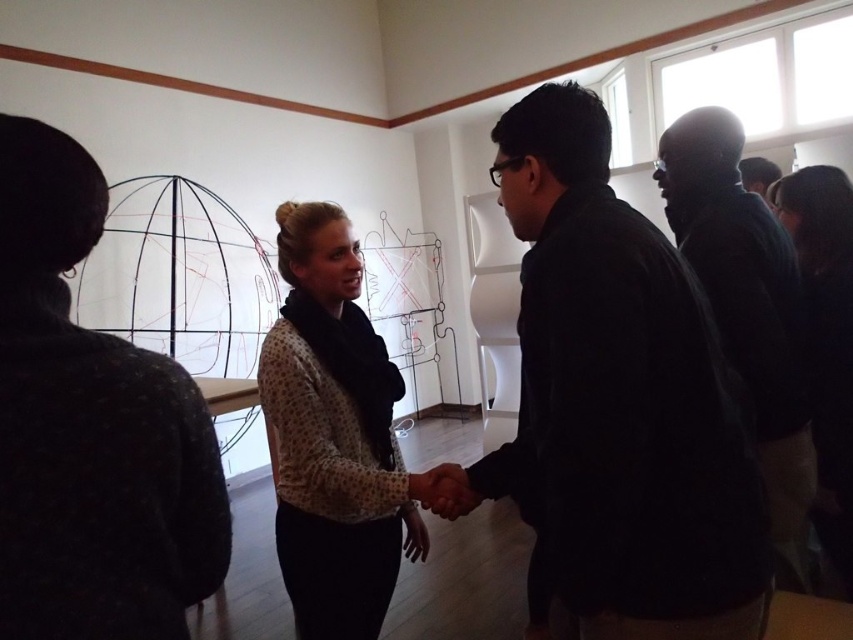
Question: Estimate the real-world distances between objects in this image. Which object is farther from the dark gray sweater at left?

Choices:
 (A) black matte jacket at center
 (B) matte black shirt at right

Answer: (B)

Question: Is black matte shirt at right smaller than matte black shirt at right?

Choices:
 (A) yes
 (B) no

Answer: (B)

Question: Does black matte jacket at center appear under black matte jacket at upper right?

Choices:
 (A) no
 (B) yes

Answer: (B)

Question: Is black matte jacket at center positioned in front of dark gray sweater at left?

Choices:
 (A) no
 (B) yes

Answer: (A)

Question: Which point is closer to the camera?

Choices:
 (A) matte black shirt at right
 (B) polka dot blouse at center
 (C) black matte jacket at upper right
 (D) black matte shirt at right

Answer: (B)

Question: Which point appears closest to the camera in this image?

Choices:
 (A) (790, 529)
 (B) (86, 352)

Answer: (B)